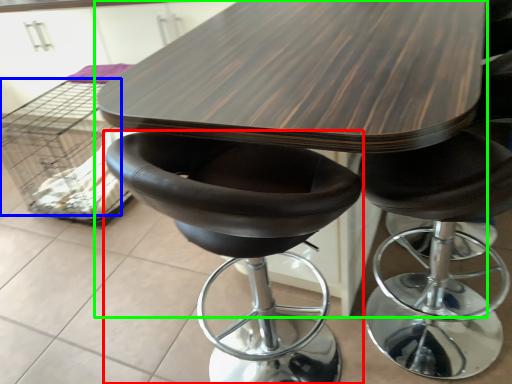
Question: Considering the real-world distances, which object is farthest from chair (highlighted by a red box)? crate (highlighted by a blue box) or table (highlighted by a green box)?

Choices:
 (A) crate
 (B) table

Answer: (A)